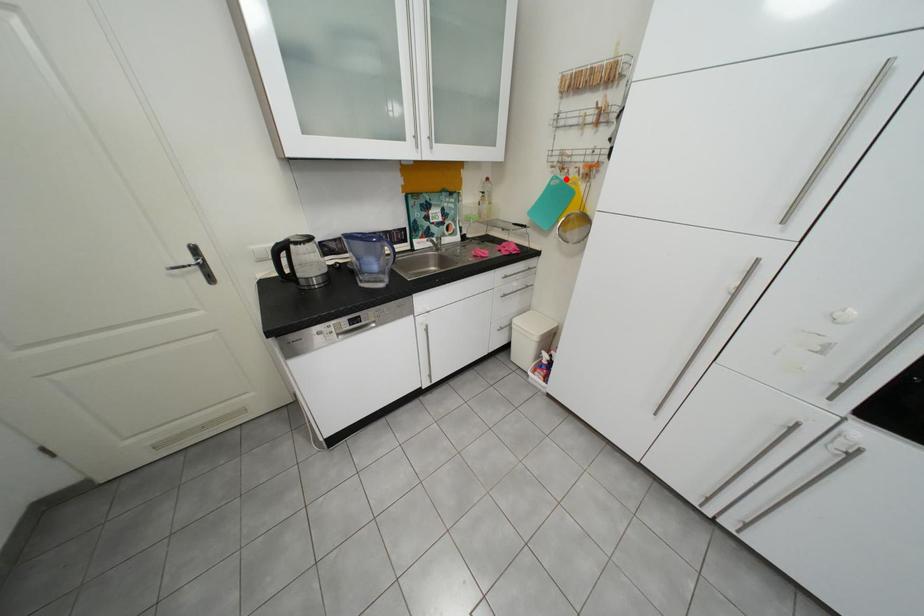
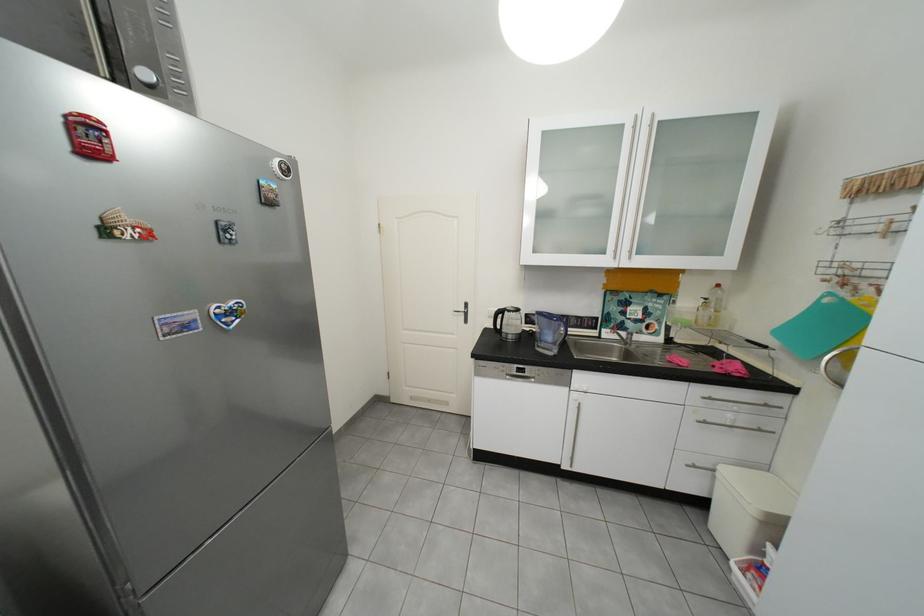
Question: I am providing you with two images of the same scene from different viewpoints. In image1, a red point is highlighted. Considering the same 3D point in image2, which of the following is correct?

Choices:
 (A) It is closer
 (B) It is farther

Answer: (B)